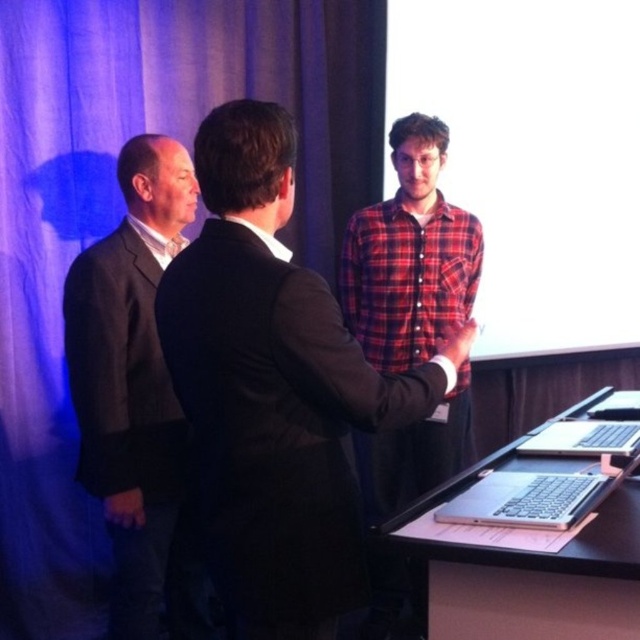
Does dark suit at center have a greater width compared to silver metallic laptop at lower right?

Correct, the width of dark suit at center exceeds that of silver metallic laptop at lower right.

Between dark suit at center and silver metallic laptop at lower right, which one appears on the right side from the viewer's perspective?

silver metallic laptop at lower right is more to the right.

Locate an element on the screen. This screenshot has height=640, width=640. dark suit at center is located at coordinates (275, 390).

Can you confirm if dark suit at center is smaller than red plaid shirt at center?

No.

Is dark suit at center bigger than red plaid shirt at center?

Yes.

Does point (312, 504) come in front of point (372, 502)?

Yes, point (312, 504) is closer to viewer.

In order to click on dark suit at center in this screenshot , I will do `click(275, 390)`.

How much distance is there between dark suit at center and dark gray suit at left?

A distance of 22.87 inches exists between dark suit at center and dark gray suit at left.

Does dark suit at center appear over dark gray suit at left?

Incorrect, dark suit at center is not positioned above dark gray suit at left.

This screenshot has height=640, width=640. Find the location of `dark suit at center`. dark suit at center is located at coordinates (275, 390).